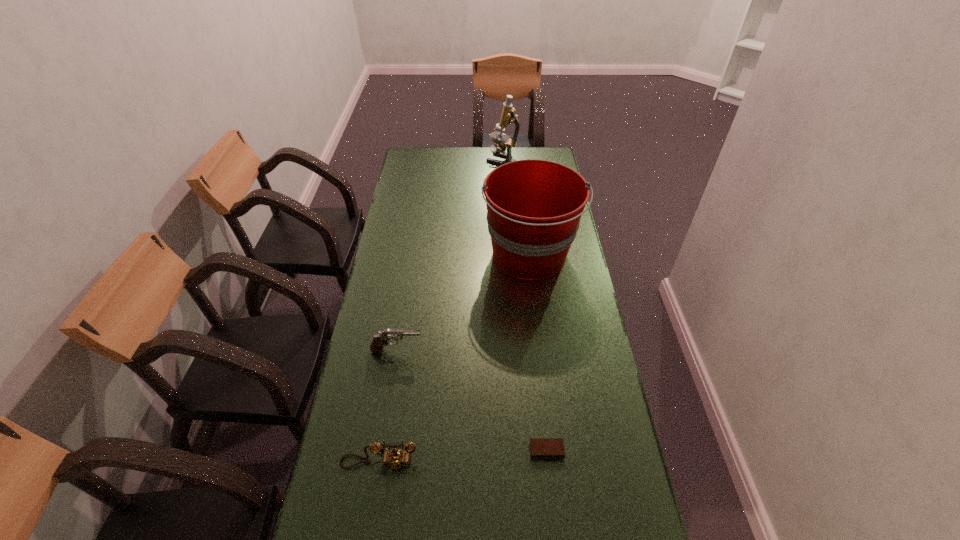
Locate which object ranks third in proximity to the pistol. Please provide its 2D coordinates. Your answer should be formatted as a tuple, i.e. [(x, y)], where the tuple contains the x and y coordinates of a point satisfying the conditions above.

[(541, 448)]